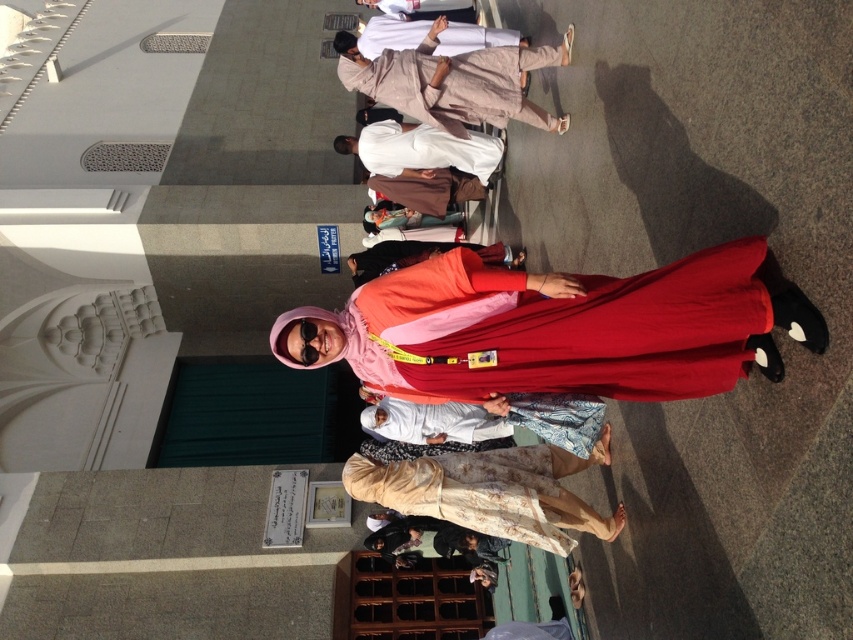
Question: Which object appears farthest from the camera in this image?

Choices:
 (A) white cotton robe at center
 (B) matte red dress at center

Answer: (A)

Question: Is beige floral dress at center thinner than beige fabric robe at upper center?

Choices:
 (A) no
 (B) yes

Answer: (B)

Question: Is beige floral dress at center thinner than white cotton robe at center?

Choices:
 (A) yes
 (B) no

Answer: (A)

Question: Observing the image, what is the correct spatial positioning of matte red dress at center in reference to beige fabric robe at upper center?

Choices:
 (A) below
 (B) above

Answer: (A)

Question: Which point appears farthest from the camera in this image?

Choices:
 (A) (563, 56)
 (B) (384, 141)

Answer: (B)

Question: Which point is farther to the camera?

Choices:
 (A) (315, 323)
 (B) (521, 508)
 (C) (502, 150)
 (D) (440, 77)

Answer: (C)